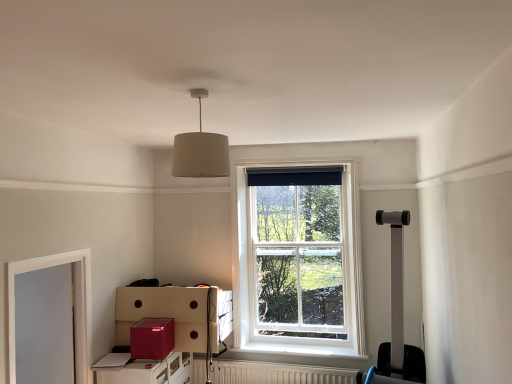
I want to click on free space above white wood frame at left (from a real-world perspective), so click(49, 251).